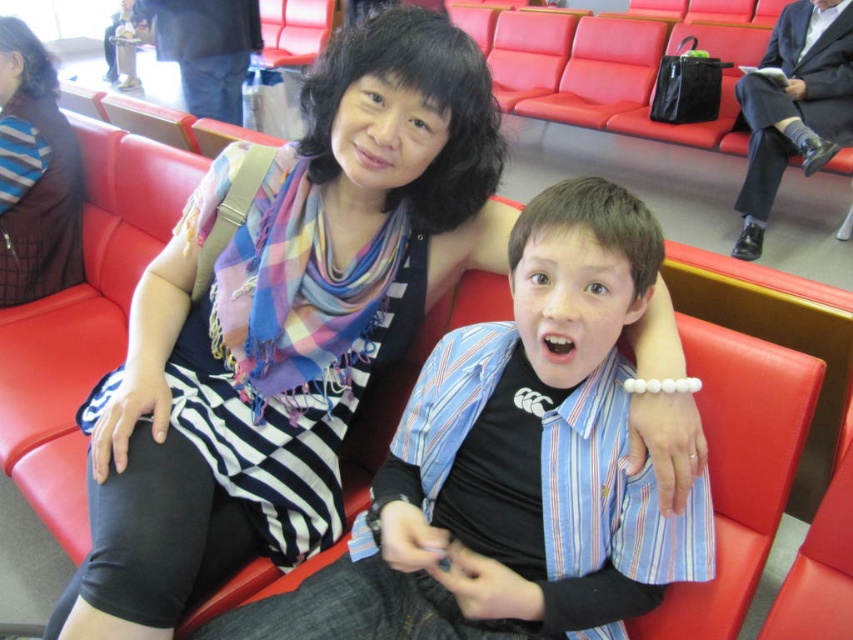
Question: Among these objects, which one is nearest to the camera?

Choices:
 (A) striped shirt at center
 (B) striped fabric scarf at upper left

Answer: (A)

Question: Among these objects, which one is nearest to the camera?

Choices:
 (A) striped fabric scarf at upper left
 (B) striped shirt at center

Answer: (B)

Question: Does striped shirt at center have a greater width compared to striped fabric scarf at upper left?

Choices:
 (A) yes
 (B) no

Answer: (A)

Question: In this image, where is striped shirt at center located relative to striped fabric scarf at upper left?

Choices:
 (A) above
 (B) below

Answer: (B)

Question: Among these points, which one is farthest from the camera?

Choices:
 (A) (425, 516)
 (B) (15, 198)

Answer: (B)

Question: Can you confirm if striped shirt at center is wider than striped fabric scarf at upper left?

Choices:
 (A) yes
 (B) no

Answer: (A)